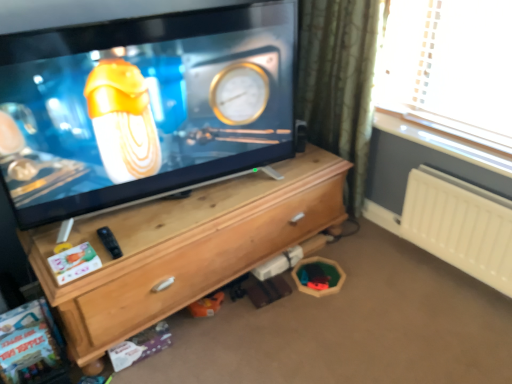
Question: From a real-world perspective, is green textured curtain at upper right on top of white plastic radiator at right?

Choices:
 (A) yes
 (B) no

Answer: (A)

Question: Are green textured curtain at upper right and white plastic radiator at right located far from each other?

Choices:
 (A) no
 (B) yes

Answer: (A)

Question: Could white plastic radiator at right be considered to be inside green textured curtain at upper right?

Choices:
 (A) no
 (B) yes

Answer: (A)

Question: From the image's perspective, would you say green textured curtain at upper right is shown under white plastic radiator at right?

Choices:
 (A) no
 (B) yes

Answer: (A)

Question: Is green textured curtain at upper right positioned with its back to white plastic radiator at right?

Choices:
 (A) yes
 (B) no

Answer: (B)

Question: Considering their positions, is matte black tv at center located in front of or behind green textured curtain at upper right?

Choices:
 (A) front
 (B) behind

Answer: (A)

Question: From a real-world perspective, is matte black tv at center above or below green textured curtain at upper right?

Choices:
 (A) below
 (B) above

Answer: (B)

Question: From the image's perspective, is matte black tv at center positioned above or below green textured curtain at upper right?

Choices:
 (A) below
 (B) above

Answer: (A)

Question: Considering the positions of matte black tv at center and green textured curtain at upper right in the image, is matte black tv at center wider or thinner than green textured curtain at upper right?

Choices:
 (A) thin
 (B) wide

Answer: (A)

Question: From the image's perspective, is green textured curtain at upper right above or below white plastic radiator at right?

Choices:
 (A) above
 (B) below

Answer: (A)

Question: Based on their sizes in the image, would you say green textured curtain at upper right is bigger or smaller than white plastic radiator at right?

Choices:
 (A) small
 (B) big

Answer: (B)

Question: Considering the positions of point (335, 104) and point (438, 213), is point (335, 104) closer or farther from the camera than point (438, 213)?

Choices:
 (A) farther
 (B) closer

Answer: (A)

Question: Visually, is green textured curtain at upper right positioned to the left or to the right of white plastic radiator at right?

Choices:
 (A) left
 (B) right

Answer: (A)

Question: From the image's perspective, relative to wooden chest of drawers at center, is white plastic radiator at right above or below?

Choices:
 (A) below
 (B) above

Answer: (B)

Question: Considering the positions of white plastic radiator at right and wooden chest of drawers at center in the image, is white plastic radiator at right taller or shorter than wooden chest of drawers at center?

Choices:
 (A) tall
 (B) short

Answer: (B)